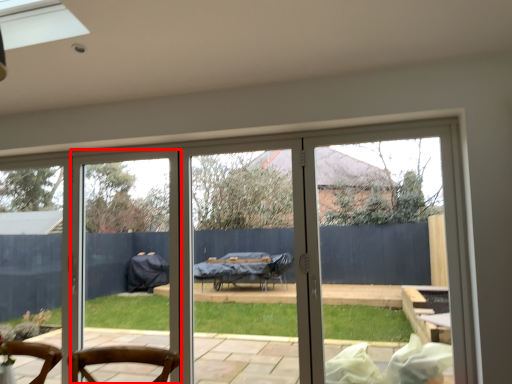
Question: From the image's perspective, considering the relative positions of screen door (annotated by the red box) and door in the image provided, where is screen door (annotated by the red box) located with respect to the staircase?

Choices:
 (A) above
 (B) below

Answer: (B)